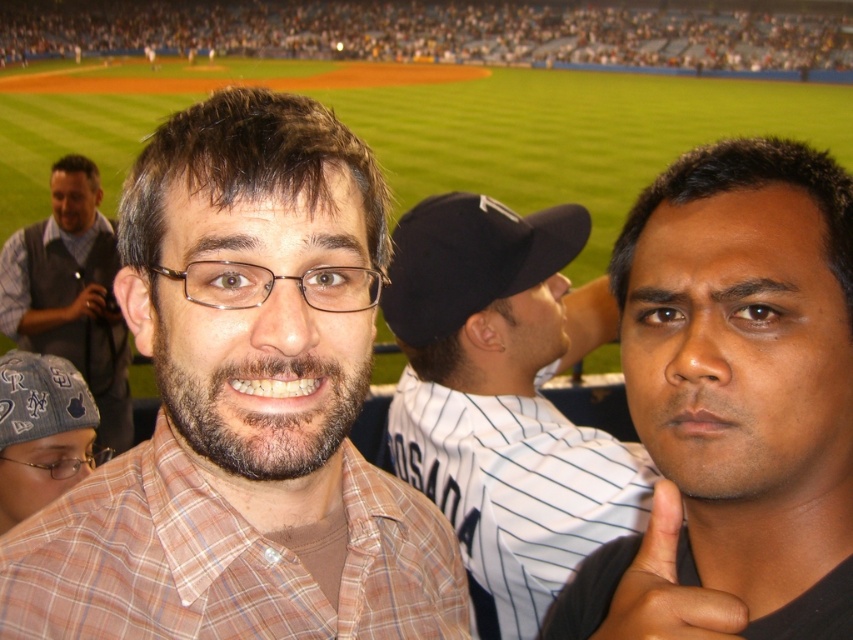
You are a photographer at the baseball stadium and want to capture a photo that includes both the gray vest at left and the dark skin textured hand at right. Based on their positions, which object should be placed on the left side of the photo frame?

The gray vest at left should be placed on the left side of the photo frame since it is positioned to the left of the dark skin textured hand at right.

You are standing at the center of the baseball field and want to throw a baseball to the point marked at coordinates point [177,532]. If your throwing range is 30 inches, will you be able to reach it?

The point [177,532] is 30.44 inches away from the viewer. Since your throwing range is 30 inches, you will not be able to reach it.

You are a photographer standing at the center of the baseball field. You want to take a photo of the gray vest at left and the dark skin textured hand at right. Can you fit both subjects in the frame if your camera has a 2.5 meter wide field of view?

The gray vest at left is 3.70 meters away from the dark skin textured hand at right. Since the distance between them is greater than the camera field of view of 2.5 meters, you cannot fit both subjects in the frame.